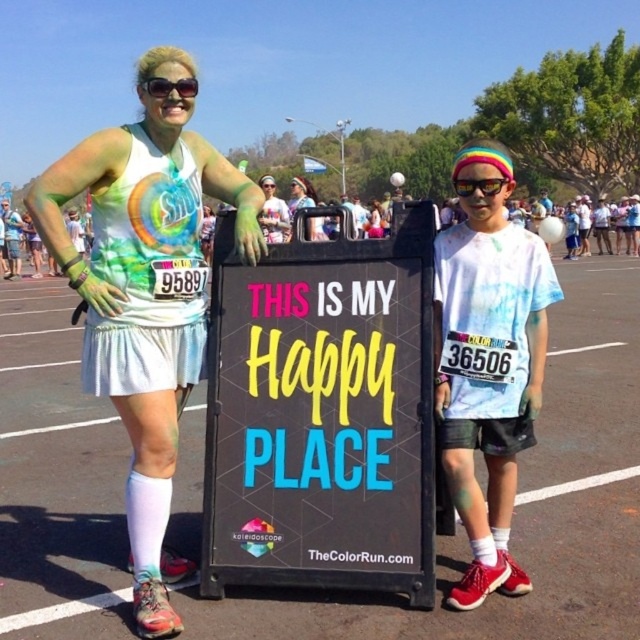
Who is positioned more to the left, matte white t-shirt at center or matte white tank top at center?

matte white tank top at center is more to the left.

Locate an element on the screen. matte white t-shirt at center is located at coordinates (488, 365).

Can you confirm if matte white tank top at center is positioned below sunglasses at upper center?

Actually, matte white tank top at center is above sunglasses at upper center.

What do you see at coordinates (300, 195) in the screenshot?
I see `matte white tank top at center` at bounding box center [300, 195].

In order to click on matte white tank top at center in this screenshot , I will do `click(300, 195)`.

Who is lower down, matte tie-dye tank top at center or multicolored plastic goggles at center?

Positioned lower is matte tie-dye tank top at center.

Is matte tie-dye tank top at center thinner than multicolored plastic goggles at center?

No, matte tie-dye tank top at center is not thinner than multicolored plastic goggles at center.

Is point (225, 189) closer to viewer compared to point (464, 193)?

That is False.

Locate an element on the screen. matte tie-dye tank top at center is located at coordinates (145, 294).